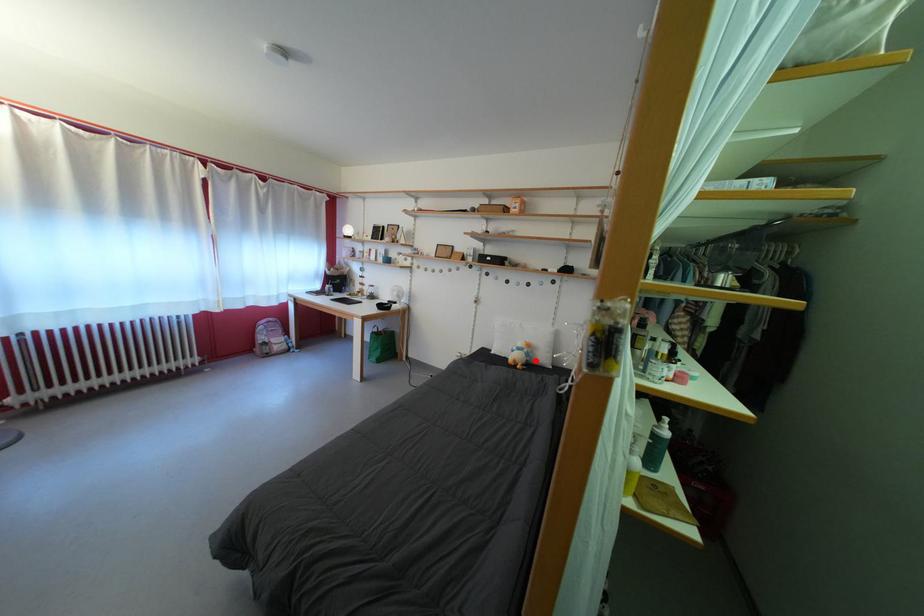
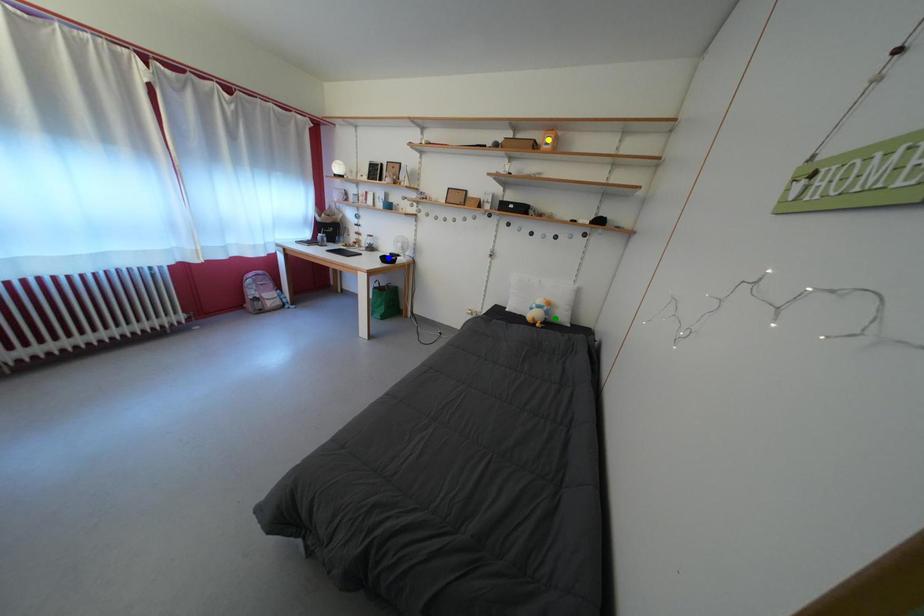
Question: I am providing you with two images of the same scene from different viewpoints. A red point is marked on the first image. You are given multiple points on the second image. Which mark in image 2 goes with the point in image 1?

Choices:
 (A) blue point
 (B) yellow point
 (C) green point

Answer: (C)